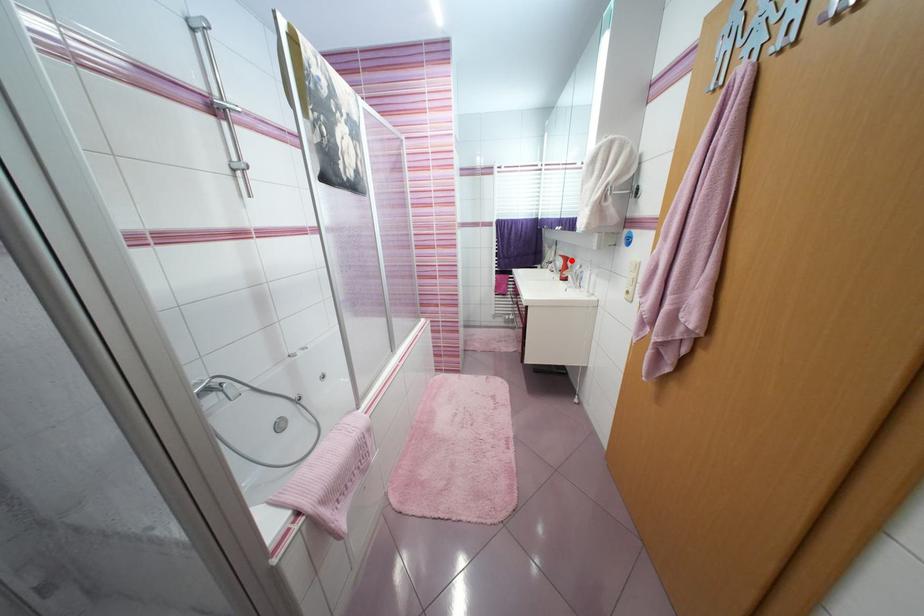
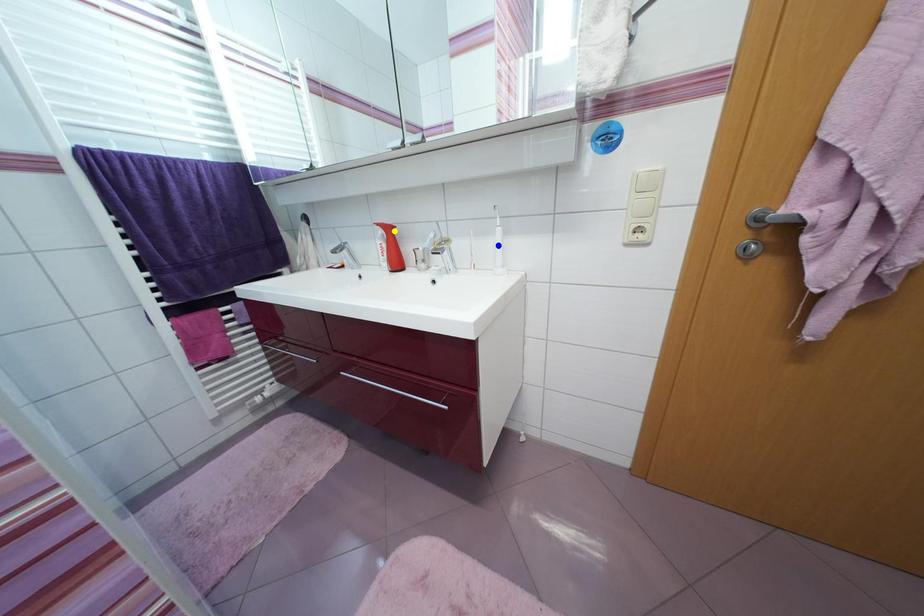
Question: I am providing you with two images of the same scene from different viewpoints. A red point is marked on the first image. You are given multiple points on the second image. Which point in image 2 is actually the same real-world point as the red point in image 1?

Choices:
 (A) green point
 (B) blue point
 (C) yellow point

Answer: (C)